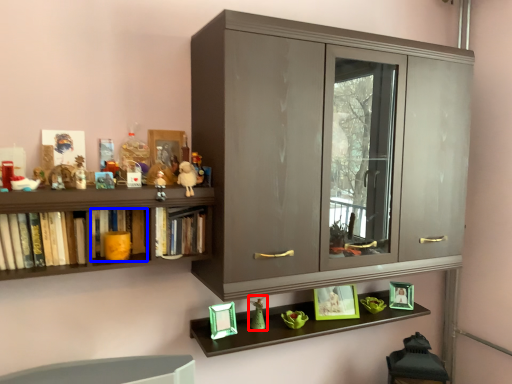
Question: Which of the following is the farthest to the observer, toy (highlighted by a red box) or book (highlighted by a blue box)?

Choices:
 (A) toy
 (B) book

Answer: (A)